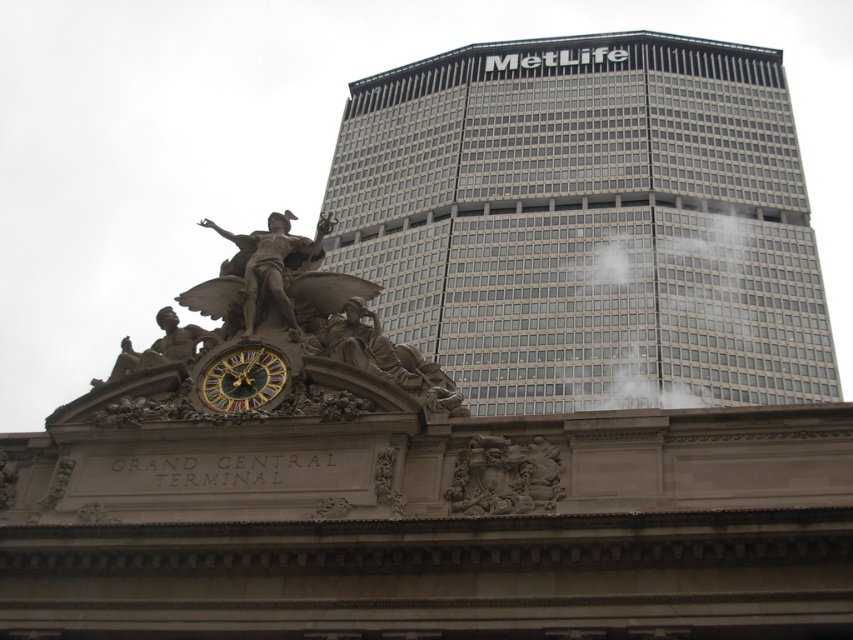
Who is positioned more to the right, white fog at center or polished bronze statue at center?

white fog at center

Looking at this image, who is taller, white fog at center or polished bronze statue at center?

white fog at center

The image size is (853, 640). What do you see at coordinates (677, 310) in the screenshot?
I see `white fog at center` at bounding box center [677, 310].

Identify the location of white fog at center. The height and width of the screenshot is (640, 853). (677, 310).

Does point (254, 253) lie in front of point (213, 372)?

No.

Can you confirm if polished bronze statue at center is positioned to the right of gold-gilded clock face at center?

Incorrect, polished bronze statue at center is not on the right side of gold-gilded clock face at center.

Between point (250, 314) and point (230, 355), which one is positioned in front?

Point (230, 355) is more forward.

Identify the location of polished bronze statue at center. This screenshot has height=640, width=853. (271, 266).

Does white fog at center have a greater height compared to carved stone relief at center?

Indeed, white fog at center has a greater height compared to carved stone relief at center.

Who is more distant from viewer, (643, 269) or (560, 470)?

Positioned behind is point (643, 269).

Which is in front, point (749, 374) or point (525, 470)?

Positioned in front is point (525, 470).

Find the location of a particular element. white fog at center is located at coordinates (677, 310).